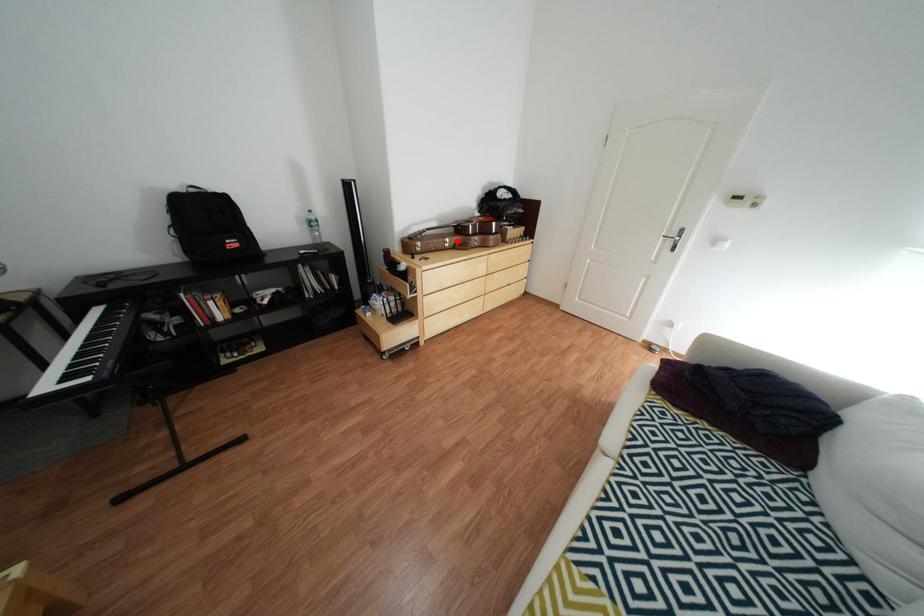
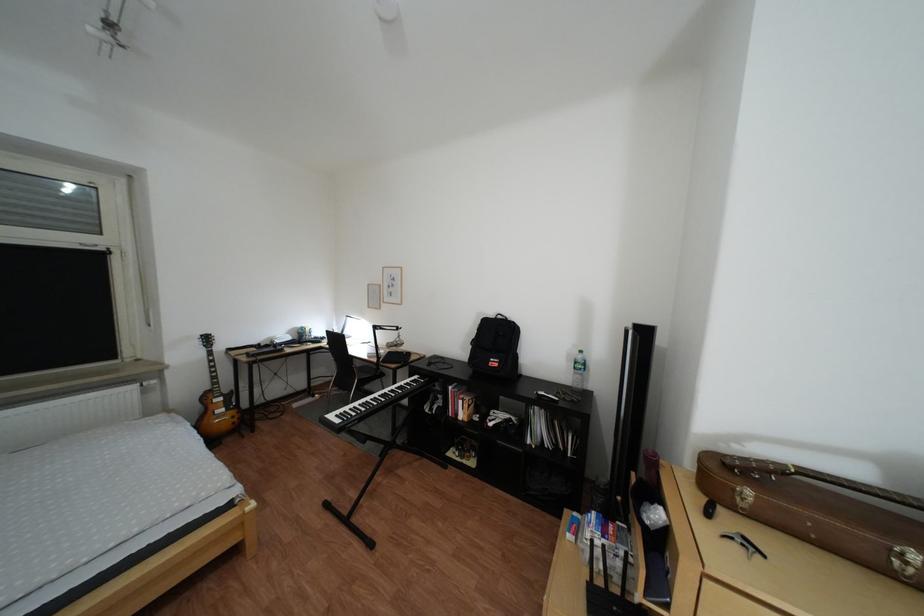
The point at the highlighted location is marked in the first image. Where is the corresponding point in the second image?

(885, 537)